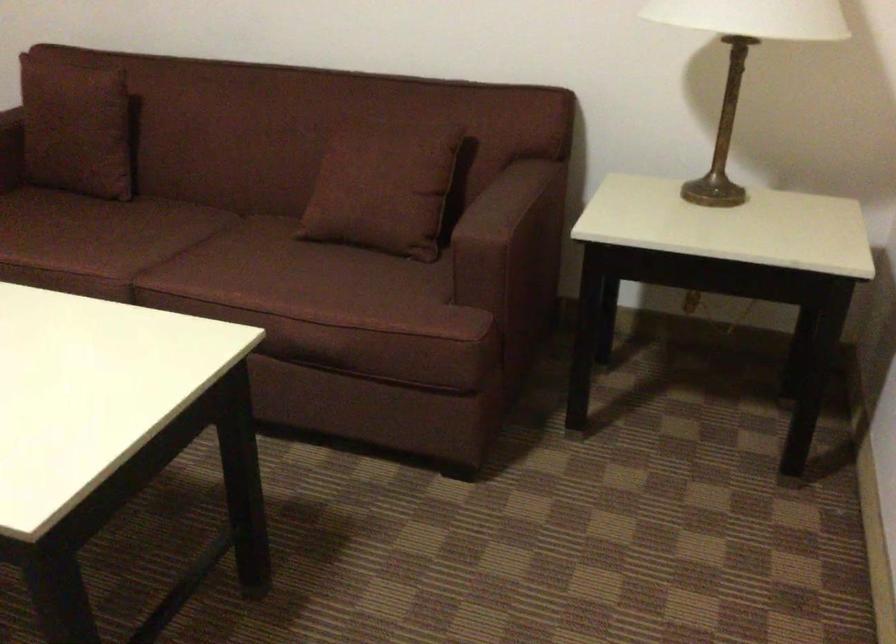
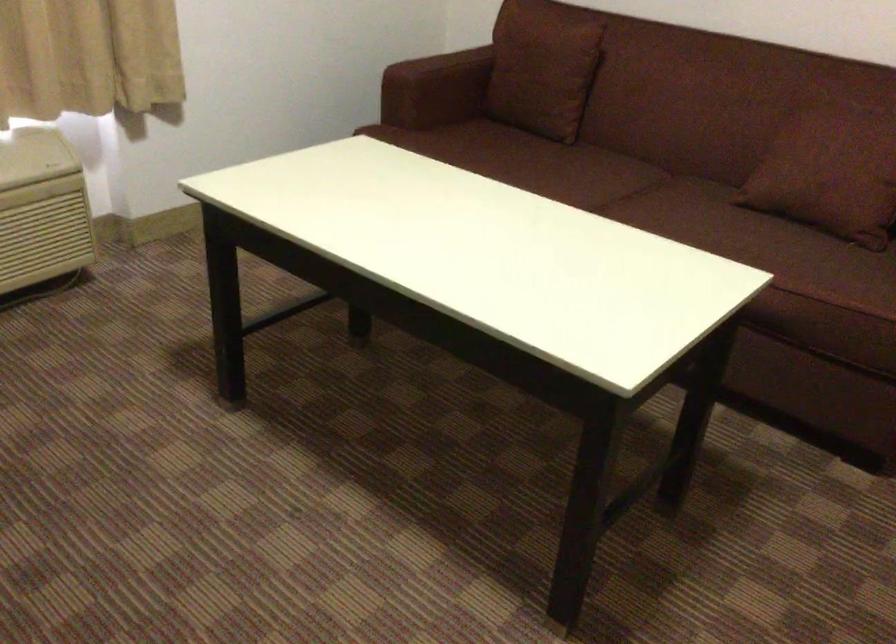
Where in the second image is the point corresponding to the point at 73,125 from the first image?

(543, 69)